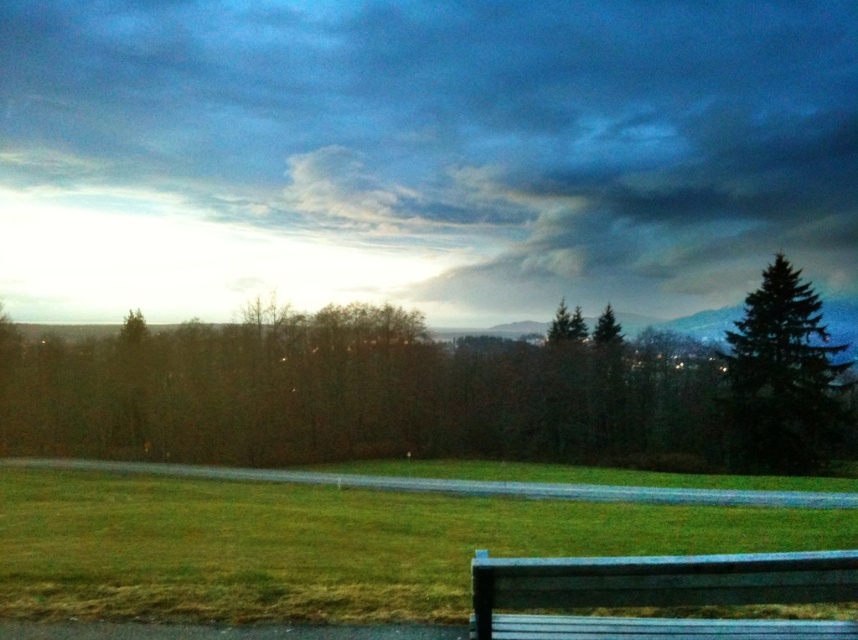
You are standing at the point closest to the viewer in the image. Which of the two points, point (631, 358) or point (627, 570), is farther away from you?

Point (631, 358) is behind point (627, 570), so it is farther away from you.

You are standing in the outdoor scene and want to walk from the point at coordinates point [442,385] to the point at coordinates point [56,540]. Based on their positions, which direction should you move relative to your current position?

You should move downward and to the right because point [56,540] is located lower and to the right of point [442,385] in the image.